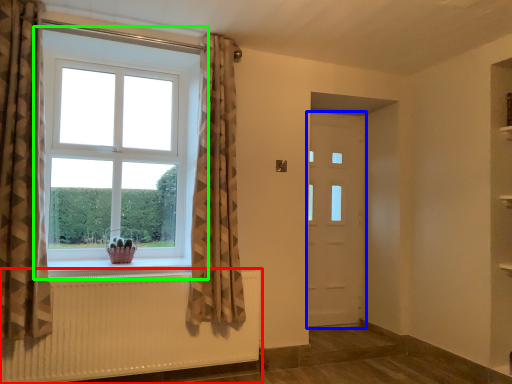
Question: Considering the real-world distances, which object is closest to radiator (highlighted by a red box)? door (highlighted by a blue box) or window (highlighted by a green box).

Choices:
 (A) door
 (B) window

Answer: (B)